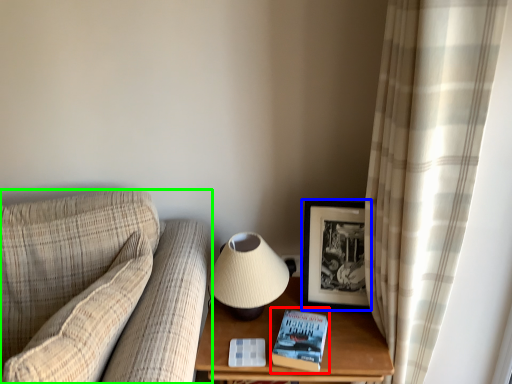
Question: Estimate the real-world distances between objects in this image. Which object is closer to paperback book (highlighted by a red box), picture frame (highlighted by a blue box) or studio couch (highlighted by a green box)?

Choices:
 (A) picture frame
 (B) studio couch

Answer: (A)